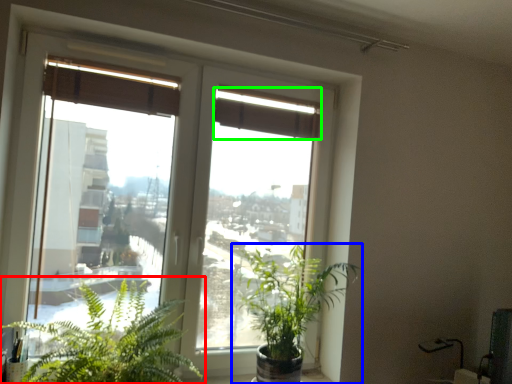
Question: Considering the real-world distances, which object is farthest from houseplant (highlighted by a red box)? houseplant (highlighted by a blue box) or curtain (highlighted by a green box)?

Choices:
 (A) houseplant
 (B) curtain

Answer: (B)